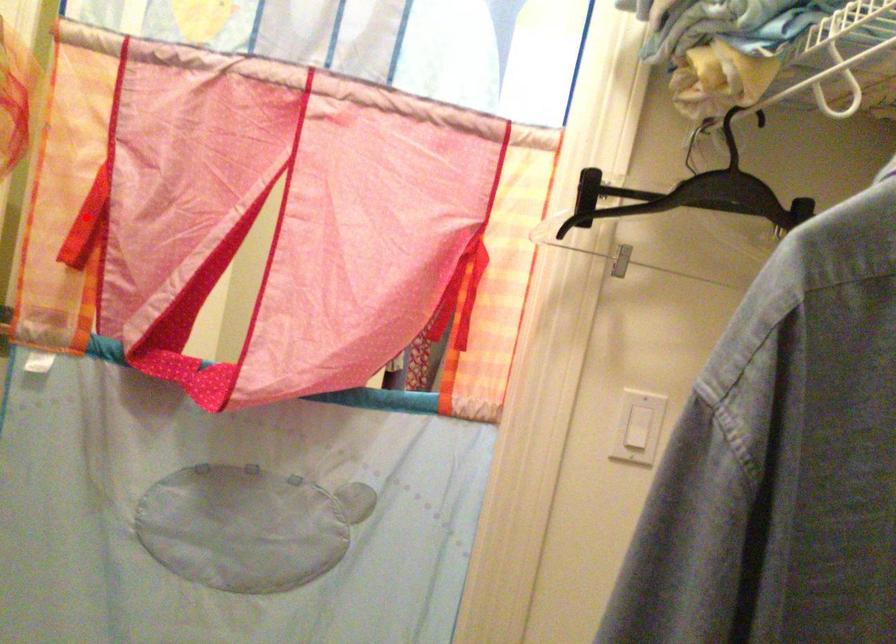
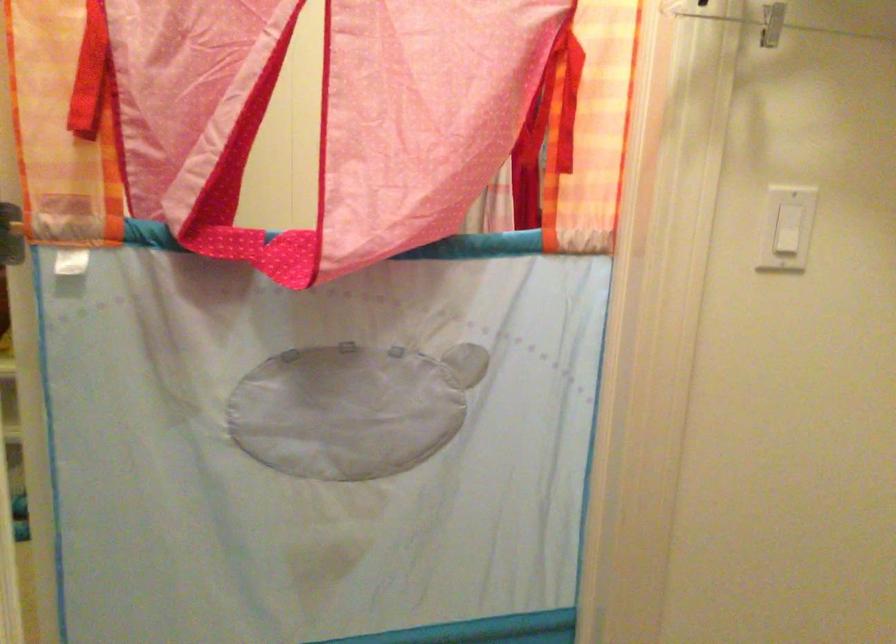
Question: I am providing you with two images of the same scene from different viewpoints. A red point is shown in image1. For the corresponding object point in image2, is it positioned nearer or farther from the camera?

Choices:
 (A) Nearer
 (B) Farther

Answer: (A)